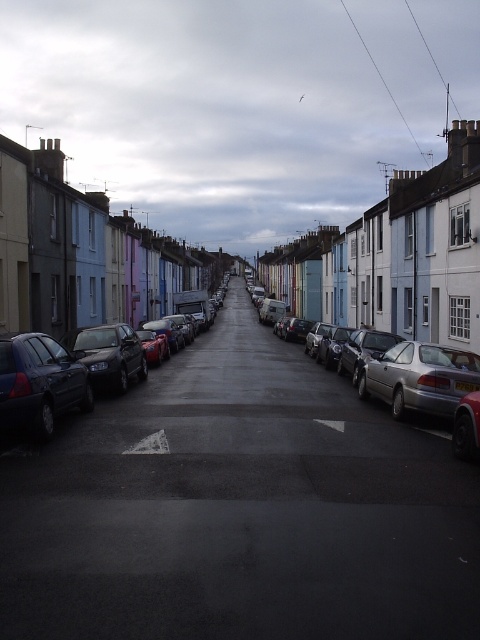
Is silver metallic sedan at center right shorter than silver metallic car at right?

No.

Identify the location of silver metallic sedan at center right. (425, 385).

Is point (405, 342) positioned behind point (398, 406)?

Yes.

The image size is (480, 640). Identify the location of silver metallic sedan at center right. (x=425, y=385).

Can you confirm if smooth asphalt road at center is positioned to the left of silver metallic sedan at center right?

Correct, you'll find smooth asphalt road at center to the left of silver metallic sedan at center right.

Between smooth asphalt road at center and silver metallic sedan at center right, which one has more height?

With more height is silver metallic sedan at center right.

Which is behind, point (136, 588) or point (418, 358)?

Positioned behind is point (418, 358).

At what (x,y) coordinates should I click in order to perform the action: click on smooth asphalt road at center. Please return your answer as a coordinate pair (x, y). The height and width of the screenshot is (640, 480). Looking at the image, I should click on (239, 508).

Does shiny black sedan at center-left have a lesser width compared to satin silver sedan at center?

No.

Between shiny black sedan at center-left and satin silver sedan at center, which one appears on the left side from the viewer's perspective?

Positioned to the left is shiny black sedan at center-left.

Describe the element at coordinates (108, 355) in the screenshot. I see `shiny black sedan at center-left` at that location.

Where is `shiny black sedan at center-left`? Image resolution: width=480 pixels, height=640 pixels. shiny black sedan at center-left is located at coordinates (108, 355).